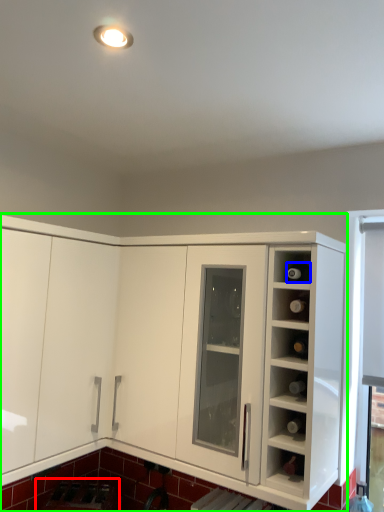
Question: Which object is positioned farthest from appliance (highlighted by a red box)? Select from wine bottle (highlighted by a blue box) and cabinetry (highlighted by a green box).

Choices:
 (A) wine bottle
 (B) cabinetry

Answer: (A)